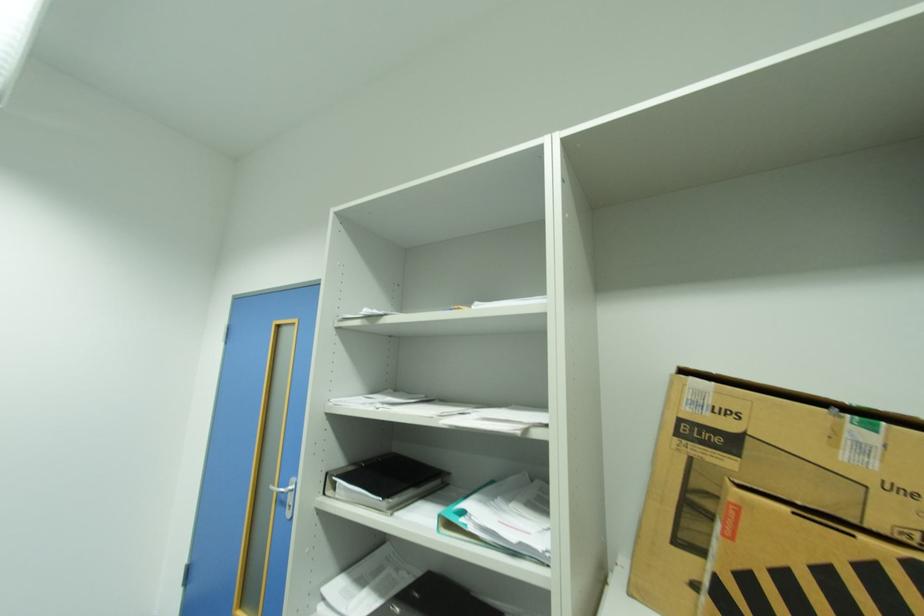
The height and width of the screenshot is (616, 924). Find the location of `silver door handle`. silver door handle is located at coordinates (286, 496).